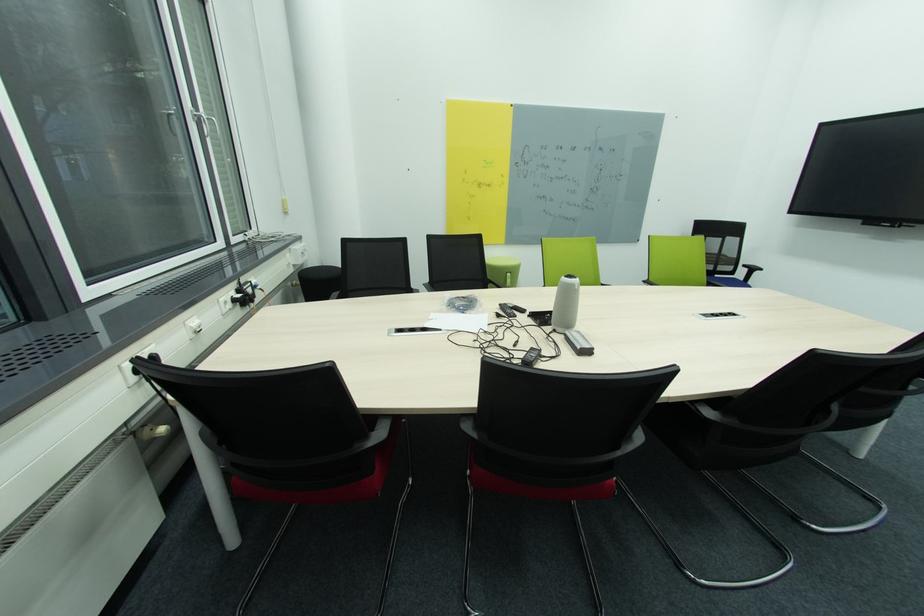
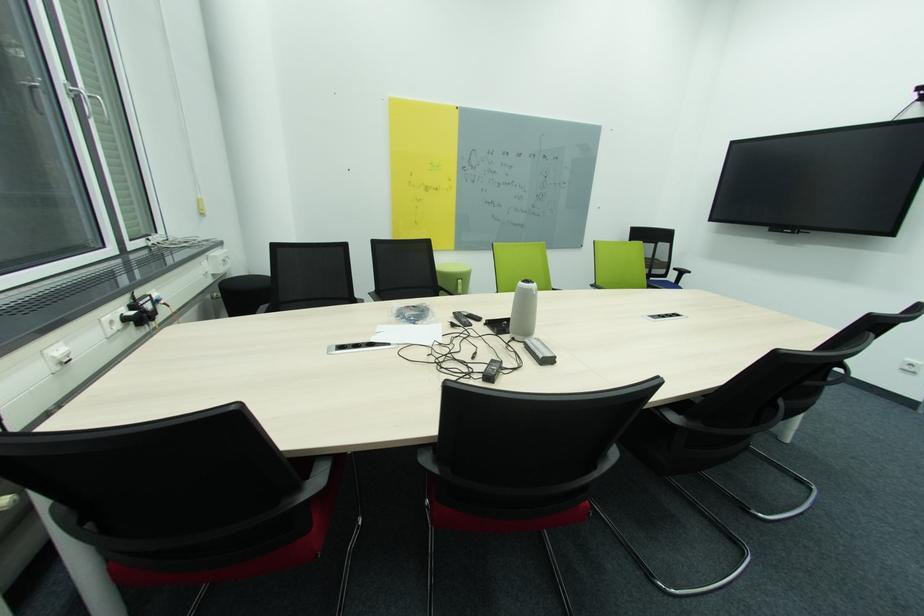
Find the pixel in the second image that matches [514,276] in the first image.

(465, 282)